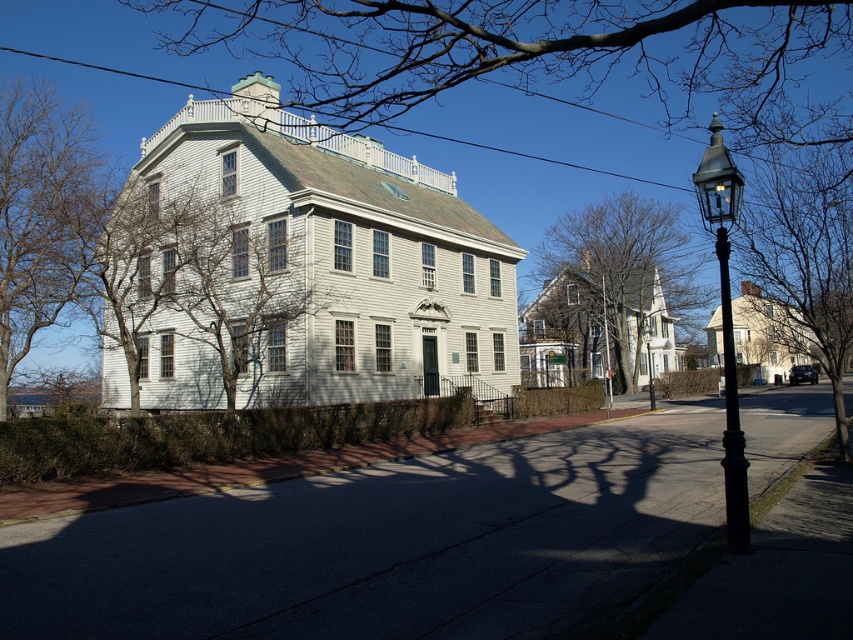
You are a painter standing on the sidewalk in front of the historic building. You want to paint the view of the building with its surroundings. Which object, the bare branches at upper center or the green leafy tree at center, will appear wider in your painting?

The bare branches at upper center will appear wider in your painting because its width is larger than the green leafy tree at center.

You are a visitor approaching the historic building and notice two sets of bare branches on either side of the path leading to the entrance. Which set of bare branches, the bare branches at left or the bare branches at center, appears taller from your perspective?

The bare branches at left appears taller than the bare branches at center from your perspective.